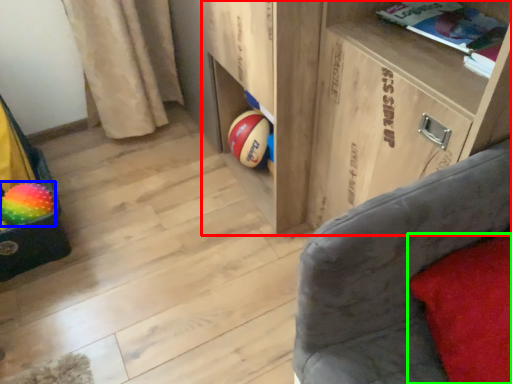
Question: Estimate the real-world distances between objects in this image. Which object is closer to shelf (highlighted by a red box), beach ball (highlighted by a blue box) or pillow (highlighted by a green box)?

Choices:
 (A) beach ball
 (B) pillow

Answer: (B)